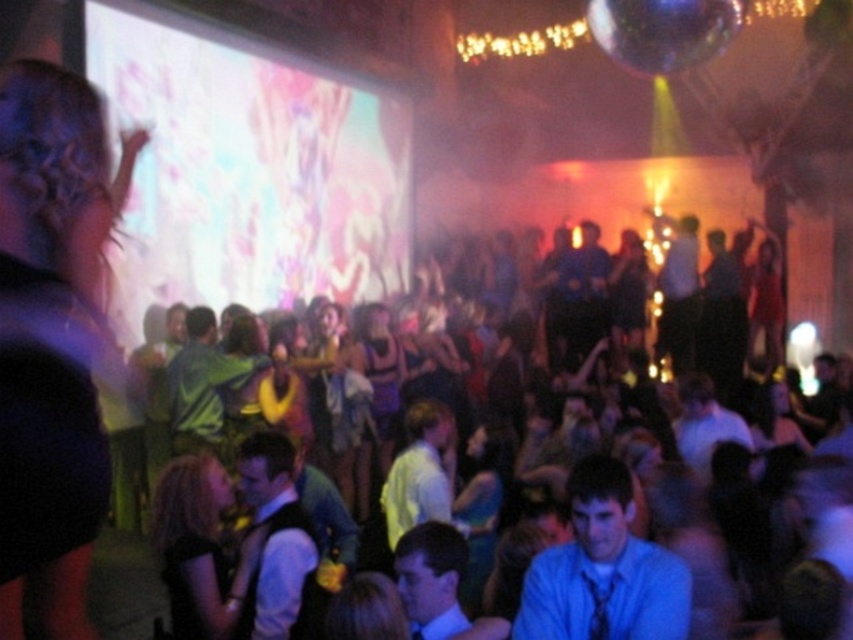
You are at the party and want to take a photo of both the black satin dress at lower left and the shiny purple dress at center. Which dress should you focus on first to ensure both are in the frame?

You should focus on the black satin dress at lower left first because it is closer to the viewer, so adjusting the camera to include it will also capture the shiny purple dress at center in the background.

You are at a party and want to move from your current position to the exit located at point (206,534). There is an obstacle at point (242,269). Based on the scene description, will you have to go around the obstacle to reach the exit?

Point (242,269) is behind point (206,534), so you will not encounter the obstacle at point (242,269) on your way to the exit at point (206,534). You can proceed directly to the exit without needing to go around.

You are at a party and want to take a photo of the shiny purple dress at center without the white glossy projection screen at upper left appearing in the frame. Which direction should you move your camera to avoid the screen?

Move the camera to the right to avoid the white glossy projection screen at upper left, as the screen is positioned to the left of the shiny purple dress at center.